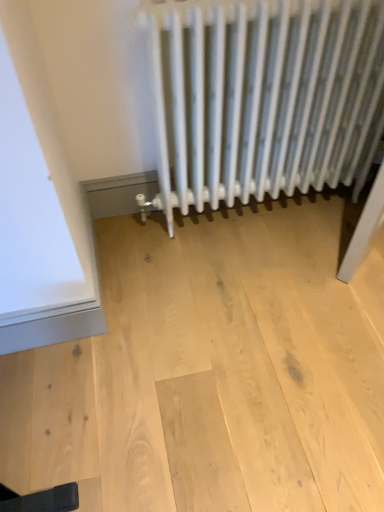
Locate an element on the screen. vacant area that is in front of white matte radiator at center is located at coordinates point(253,298).